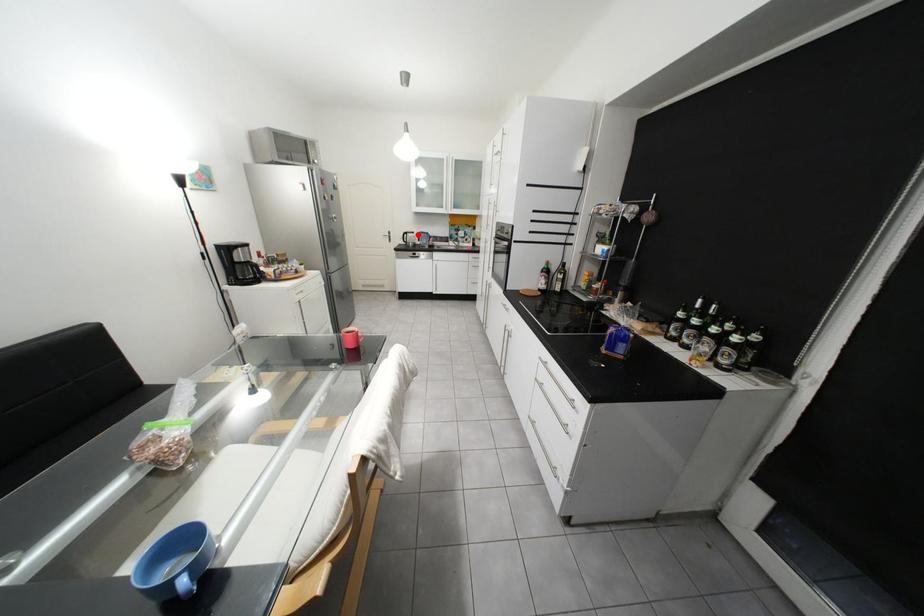
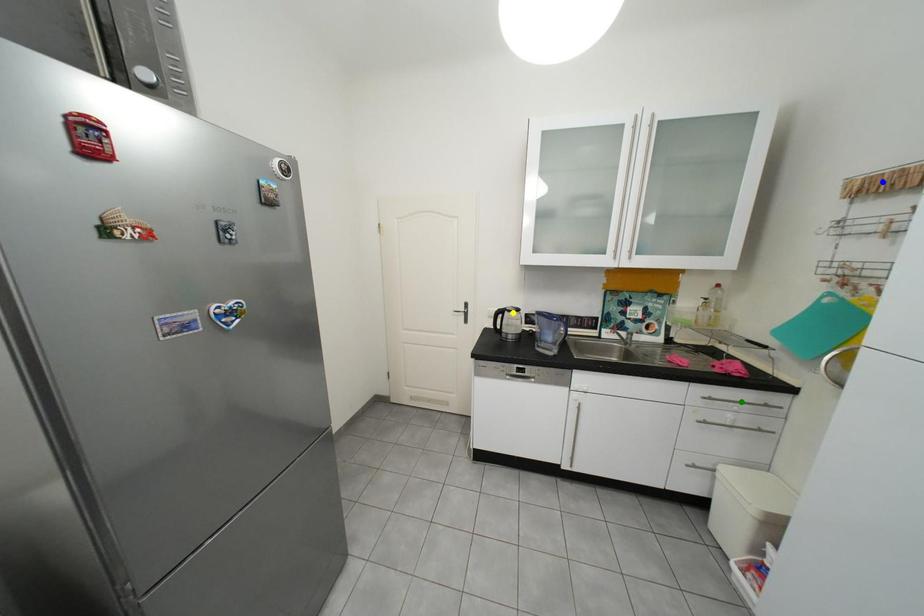
Question: I am providing you with two images of the same scene from different viewpoints. A red point is marked on the first image. You are given multiple points on the second image. Which point in image 2 is actually the same real-world point as the red point in image 1?

Choices:
 (A) green point
 (B) yellow point
 (C) blue point

Answer: (B)